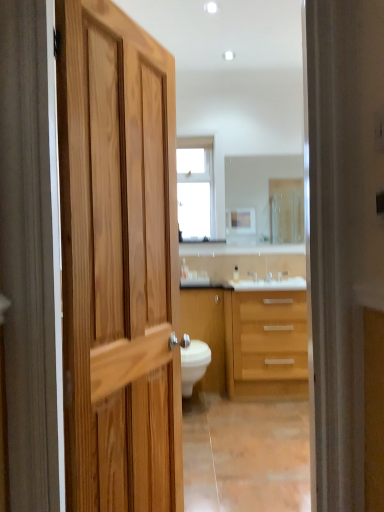
Where is `empty space that is ontop of matte wood cabinet at center (from a real-world perspective)`? This screenshot has height=512, width=384. empty space that is ontop of matte wood cabinet at center (from a real-world perspective) is located at coordinates (201, 283).